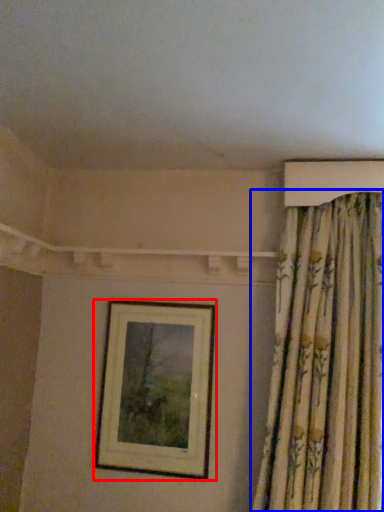
Question: Among these objects, which one is farthest to the camera, picture frame (highlighted by a red box) or curtain (highlighted by a blue box)?

Choices:
 (A) picture frame
 (B) curtain

Answer: (A)